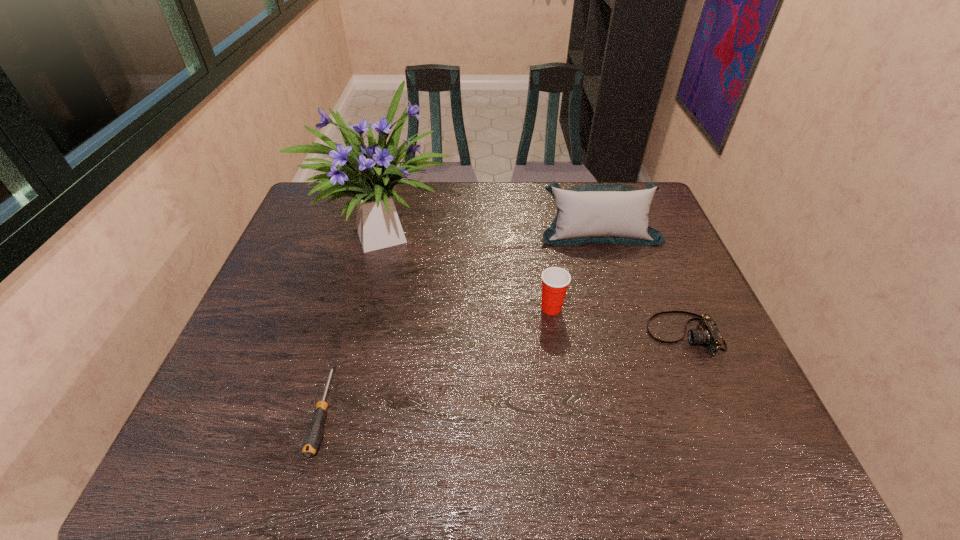
At what (x,y) coordinates should I click in order to perform the action: click on empty space that is in between the flower arrangement and the third shortest object. Please return your answer as a coordinate pair (x, y). Looking at the image, I should click on (469, 269).

Locate an element on the screen. The height and width of the screenshot is (540, 960). free space that is in between the second shortest object and the screwdriver is located at coordinates (504, 372).

Image resolution: width=960 pixels, height=540 pixels. What are the coordinates of `blank region between the camera and the cushion` in the screenshot? It's located at (641, 283).

The image size is (960, 540). What are the coordinates of `free space between the shortest object and the fourth tallest object` in the screenshot? It's located at (504, 372).

The width and height of the screenshot is (960, 540). I want to click on vacant area that lies between the second shortest object and the Dixie cup, so click(617, 321).

Where is `object identified as the closest to the shortest object`? The height and width of the screenshot is (540, 960). object identified as the closest to the shortest object is located at coordinates [369, 174].

This screenshot has width=960, height=540. I want to click on the closest object relative to the Dixie cup, so click(x=707, y=333).

You are a GUI agent. You are given a task and a screenshot of the screen. Output one action in this format:
    pyautogui.click(x=<x>, y=<y>)
    Task: Click on the free space that satisfies the following two spatial constraints: 1. on the back side of the shortest object; 2. on the left side of the Dixie cup
    
    Given the screenshot: What is the action you would take?
    pyautogui.click(x=352, y=308)

Image resolution: width=960 pixels, height=540 pixels. What are the coordinates of `blank space that satisfies the following two spatial constraints: 1. on the front-facing side of the second shortest object; 2. on the front side of the nearest object` in the screenshot? It's located at (716, 410).